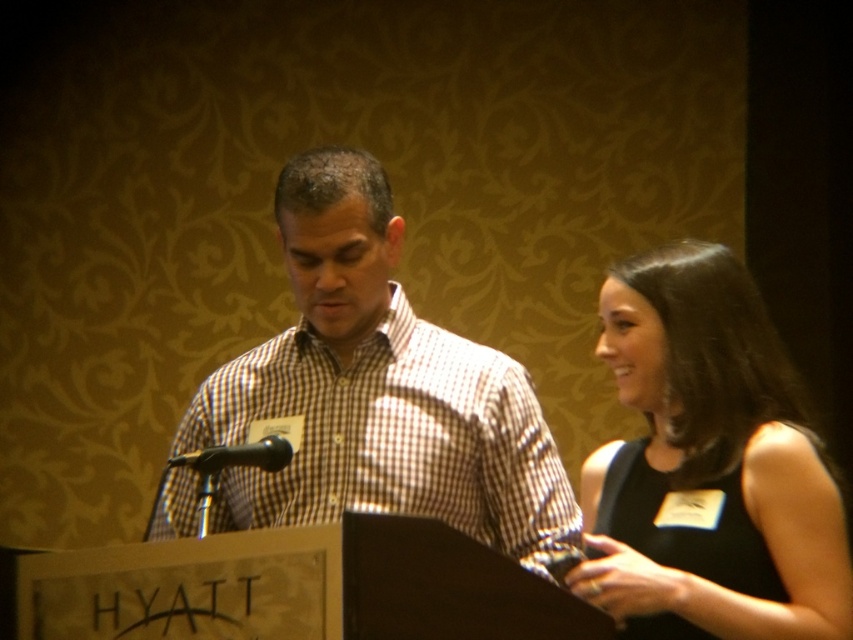
Who is taller, white checkered shirt at center or black metallic microphone at center?

With more height is white checkered shirt at center.

Locate an element on the screen. white checkered shirt at center is located at coordinates (378, 392).

The width and height of the screenshot is (853, 640). I want to click on white checkered shirt at center, so click(x=378, y=392).

Based on the photo, measure the distance between black satin dress at right and black metallic microphone at center.

A distance of 32.55 inches exists between black satin dress at right and black metallic microphone at center.

Can you confirm if black satin dress at right is shorter than black metallic microphone at center?

No.

Who is more distant from viewer, (x=653, y=604) or (x=219, y=449)?

The point (x=219, y=449) is behind.

The height and width of the screenshot is (640, 853). What are the coordinates of `black satin dress at right` in the screenshot? It's located at (712, 464).

Can you confirm if white checkered shirt at center is smaller than black satin dress at right?

Actually, white checkered shirt at center might be larger than black satin dress at right.

Who is more distant from viewer, [288,362] or [798,621]?

The point [288,362] is behind.

The width and height of the screenshot is (853, 640). In order to click on white checkered shirt at center in this screenshot , I will do `click(378, 392)`.